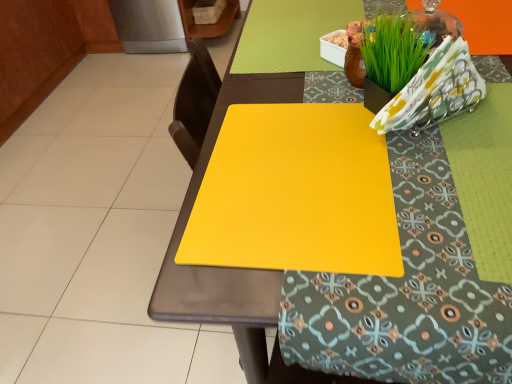
Question: Should I look upward or downward to see yellow matte cutting board at center?

Choices:
 (A) up
 (B) down

Answer: (A)

Question: From a real-world perspective, is yellow matte cutting board at center physically below yellow matte placemat at center?

Choices:
 (A) no
 (B) yes

Answer: (A)

Question: Is yellow matte cutting board at center positioned far away from yellow matte placemat at center?

Choices:
 (A) yes
 (B) no

Answer: (B)

Question: Is yellow matte cutting board at center taller than yellow matte placemat at center?

Choices:
 (A) yes
 (B) no

Answer: (B)

Question: Is yellow matte cutting board at center positioned with its back to yellow matte placemat at center?

Choices:
 (A) no
 (B) yes

Answer: (B)

Question: From the image's perspective, does yellow matte cutting board at center appear lower than yellow matte placemat at center?

Choices:
 (A) yes
 (B) no

Answer: (B)

Question: Is yellow matte cutting board at center further to the viewer compared to yellow matte placemat at center?

Choices:
 (A) yes
 (B) no

Answer: (A)

Question: Is yellow matte placemat at center at the left side of yellow matte cutting board at center?

Choices:
 (A) yes
 (B) no

Answer: (B)

Question: Does yellow matte placemat at center have a smaller size compared to yellow matte cutting board at center?

Choices:
 (A) no
 (B) yes

Answer: (A)

Question: From a real-world perspective, is yellow matte placemat at center located higher than yellow matte cutting board at center?

Choices:
 (A) yes
 (B) no

Answer: (B)

Question: Is yellow matte placemat at center further to camera compared to yellow matte cutting board at center?

Choices:
 (A) no
 (B) yes

Answer: (A)

Question: Considering the relative sizes of yellow matte placemat at center and yellow matte cutting board at center in the image provided, is yellow matte placemat at center shorter than yellow matte cutting board at center?

Choices:
 (A) no
 (B) yes

Answer: (A)

Question: From the image's perspective, is yellow matte placemat at center beneath yellow matte cutting board at center?

Choices:
 (A) no
 (B) yes

Answer: (B)

Question: In terms of height, does yellow matte placemat at center look taller or shorter compared to yellow matte cutting board at center?

Choices:
 (A) short
 (B) tall

Answer: (B)